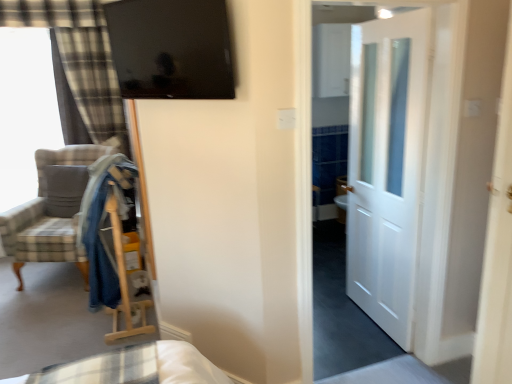
Question: From a real-world perspective, relative to plaid fabric armchair at left, is glossy black tv at upper center vertically above or below?

Choices:
 (A) above
 (B) below

Answer: (A)

Question: Is glossy black tv at upper center inside the boundaries of plaid fabric armchair at left, or outside?

Choices:
 (A) inside
 (B) outside

Answer: (B)

Question: Which object is the farthest from the white glossy door at center, which appears as the second door when viewed from the front?

Choices:
 (A) white wooden door at center, the 1th door from the front
 (B) plaid fabric armchair at left
 (C) glossy black tv at upper center
 (D) denim robe at left
 (E) soft gray pillow at left

Answer: (E)

Question: Which object is positioned farthest from the plaid fabric armchair at left?

Choices:
 (A) white glossy door at center, which appears as the second door when viewed from the front
 (B) plaid fabric curtain at left
 (C) soft gray pillow at left
 (D) white wooden door at center, the 1th door from the front
 (E) denim robe at left

Answer: (D)